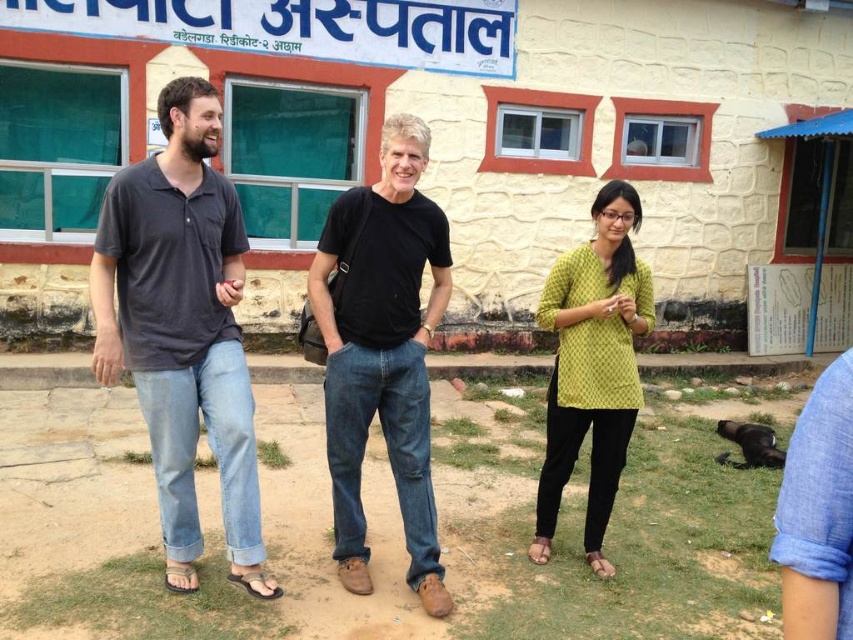
Question: Does dark gray cotton shirt at left come behind black cotton t-shirt at center?

Choices:
 (A) no
 (B) yes

Answer: (A)

Question: Which object is farther from the camera taking this photo?

Choices:
 (A) black cotton t-shirt at center
 (B) dark gray cotton shirt at left
 (C) yellow printed top at center

Answer: (C)

Question: Is dark gray cotton shirt at left above black cotton t-shirt at center?

Choices:
 (A) no
 (B) yes

Answer: (B)

Question: Estimate the real-world distances between objects in this image. Which object is closer to the black cotton t-shirt at center?

Choices:
 (A) dark gray cotton shirt at left
 (B) yellow printed top at center

Answer: (A)

Question: Can you confirm if dark gray cotton shirt at left is positioned to the right of black cotton t-shirt at center?

Choices:
 (A) yes
 (B) no

Answer: (B)

Question: Based on their relative distances, which object is farther from the yellow printed top at center?

Choices:
 (A) dark gray cotton shirt at left
 (B) black cotton t-shirt at center

Answer: (A)